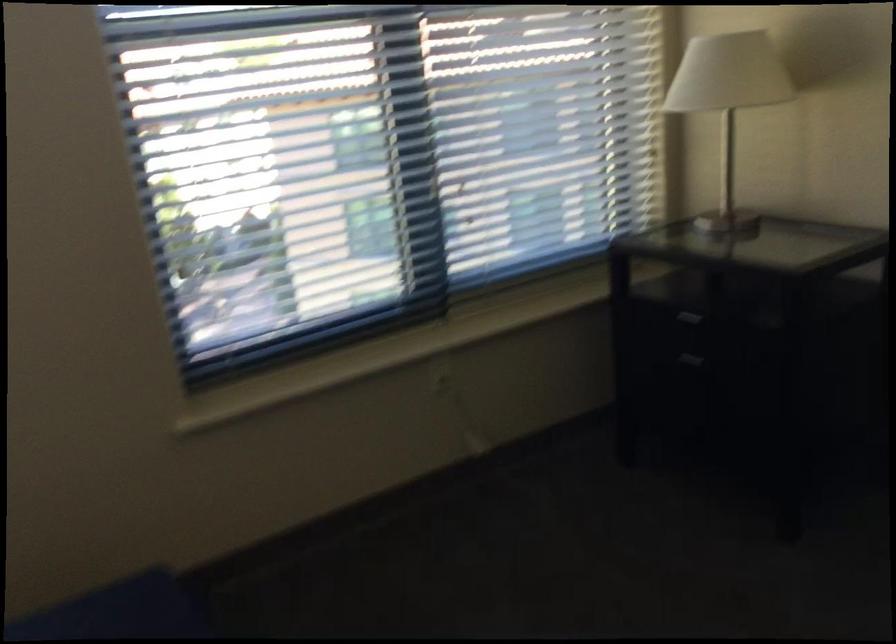
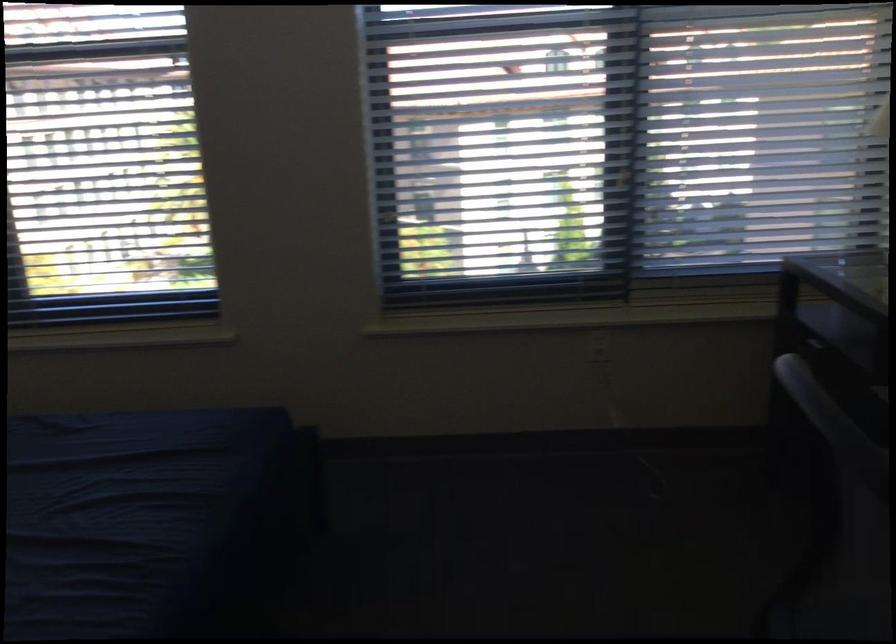
Question: The images are taken continuously from a first-person perspective. In which direction is your viewpoint rotating?

Choices:
 (A) Left
 (B) Right
 (C) Up
 (D) Down

Answer: (A)